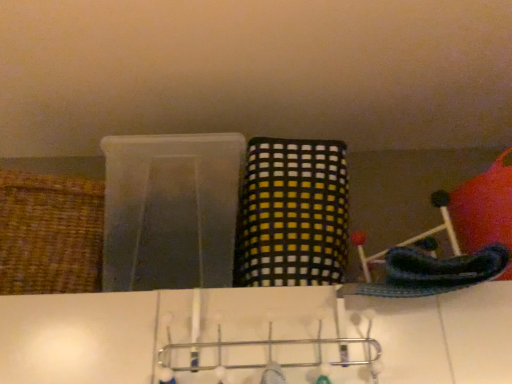
Question: From the image's perspective, is metallic silver hanger at center above or below woven brown basket at left, which ranks as the second basket in right-to-left order?

Choices:
 (A) below
 (B) above

Answer: (A)

Question: Based on their sizes in the image, would you say metallic silver hanger at center is bigger or smaller than woven brown basket at left, which ranks as the second basket in right-to-left order?

Choices:
 (A) small
 (B) big

Answer: (A)

Question: Which of these objects is positioned farthest from the metallic silver hanger at center?

Choices:
 (A) yellow checkered fabric basket at center, which is the first basket in right-to-left order
 (B) woven brown basket at left, which ranks as the second basket in right-to-left order

Answer: (B)

Question: Considering the real-world distances, which object is farthest from the woven brown basket at left, which ranks as the second basket in right-to-left order?

Choices:
 (A) yellow checkered fabric basket at center, which appears as the 2th basket when viewed from the left
 (B) metallic silver hanger at center

Answer: (A)